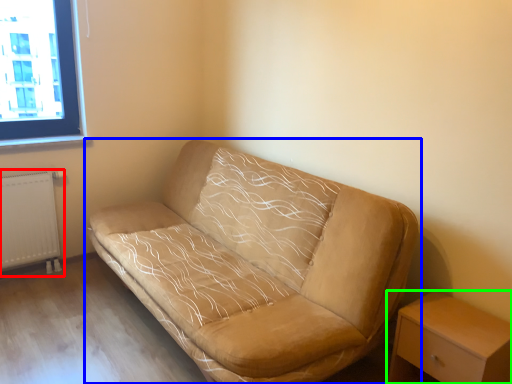
Question: Which object is positioned farthest from radiator (highlighted by a red box)? Select from studio couch (highlighted by a blue box) and nightstand (highlighted by a green box).

Choices:
 (A) studio couch
 (B) nightstand

Answer: (B)